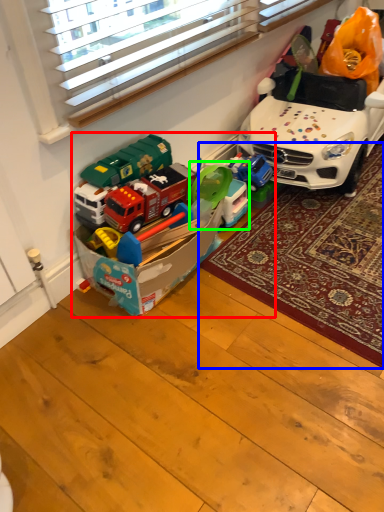
Question: Which is nearer to the toy (highlighted by a red box)? mat (highlighted by a blue box) or toy (highlighted by a green box).

Choices:
 (A) mat
 (B) toy

Answer: (B)